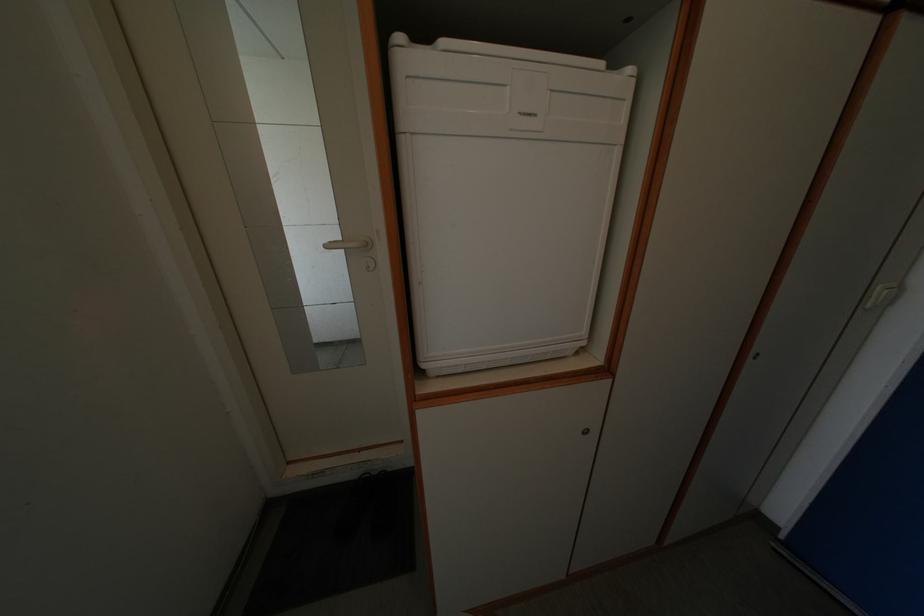
Where is `door keyhole`? door keyhole is located at coordinates (369, 262).